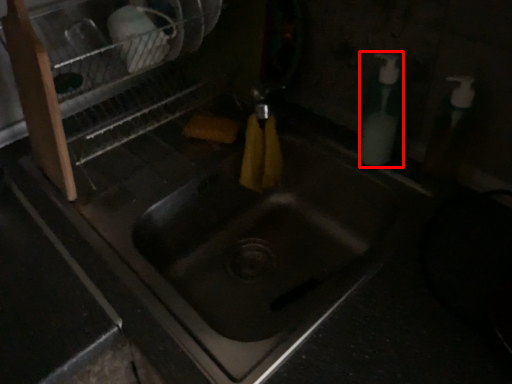
Question: From the image's perspective, where is soap dispenser (annotated by the red box) located in relation to dish washer in the image?

Choices:
 (A) above
 (B) below

Answer: (B)